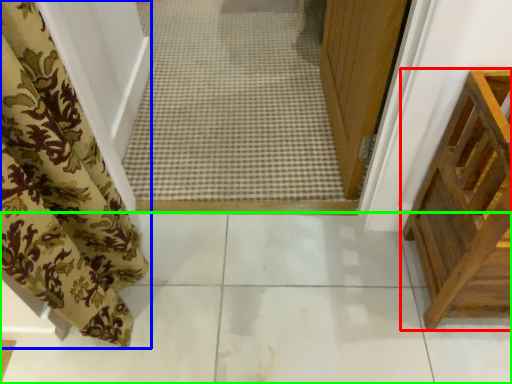
Question: Which is nearer to the furniture (highlighted by a red box)? curtain (highlighted by a blue box) or path (highlighted by a green box).

Choices:
 (A) curtain
 (B) path

Answer: (B)